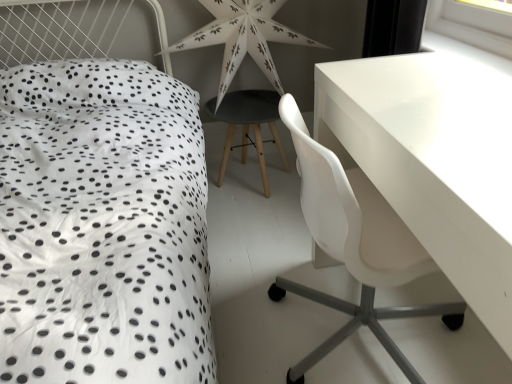
Question: Is matte black stool at center not near white plastic chair at right?

Choices:
 (A) no
 (B) yes

Answer: (A)

Question: From a real-world perspective, is matte black stool at center positioned under white plastic chair at right based on gravity?

Choices:
 (A) no
 (B) yes

Answer: (B)

Question: Is matte black stool at center oriented away from white plastic chair at right?

Choices:
 (A) yes
 (B) no

Answer: (B)

Question: From the image's perspective, is matte black stool at center beneath white plastic chair at right?

Choices:
 (A) yes
 (B) no

Answer: (B)

Question: Are matte black stool at center and white plastic chair at right beside each other?

Choices:
 (A) yes
 (B) no

Answer: (B)

Question: Considering the relative positions of matte black stool at center and white plastic chair at right in the image provided, is matte black stool at center to the right of white plastic chair at right from the viewer's perspective?

Choices:
 (A) yes
 (B) no

Answer: (B)

Question: Does white plastic chair at right have a smaller size compared to matte black stool at center?

Choices:
 (A) no
 (B) yes

Answer: (A)

Question: Is white plastic chair at right oriented towards matte black stool at center?

Choices:
 (A) no
 (B) yes

Answer: (A)

Question: Is white plastic chair at right located outside matte black stool at center?

Choices:
 (A) no
 (B) yes

Answer: (B)

Question: From the image's perspective, is white plastic chair at right located beneath matte black stool at center?

Choices:
 (A) yes
 (B) no

Answer: (A)

Question: Does white plastic chair at right have a larger size compared to matte black stool at center?

Choices:
 (A) yes
 (B) no

Answer: (A)

Question: From a real-world perspective, does white plastic chair at right sit lower than matte black stool at center?

Choices:
 (A) yes
 (B) no

Answer: (B)

Question: From a real-world perspective, is white plastic chair at right located beneath white paper star at center?

Choices:
 (A) yes
 (B) no

Answer: (A)